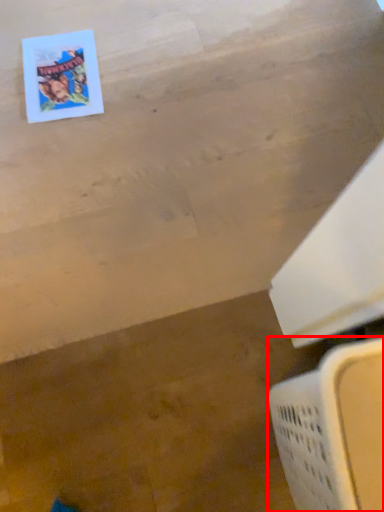
Question: From the image, what is the correct spatial relationship of laundry basket (annotated by the red box) in relation to comic book?

Choices:
 (A) right
 (B) left

Answer: (A)